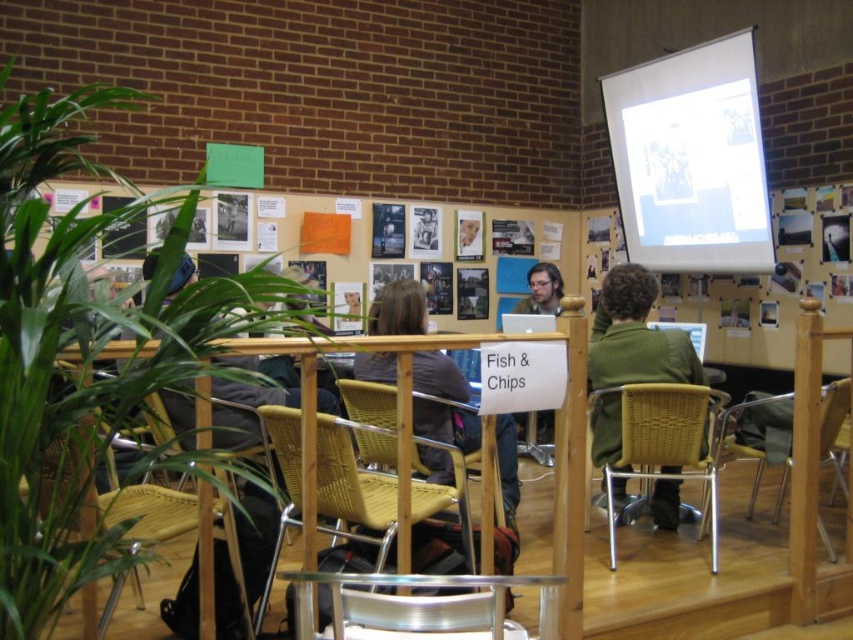
Can you confirm if white matte projection screen at upper right is positioned to the right of clear plastic chair at lower center?

Indeed, white matte projection screen at upper right is positioned on the right side of clear plastic chair at lower center.

Is point (737, 260) positioned behind point (442, 614)?

Yes, point (737, 260) is behind point (442, 614).

The width and height of the screenshot is (853, 640). I want to click on white matte projection screen at upper right, so click(x=691, y=160).

Does green leafy plant at left have a lesser width compared to white matte projection screen at upper right?

Indeed, green leafy plant at left has a lesser width compared to white matte projection screen at upper right.

Who is positioned more to the left, green leafy plant at left or white matte projection screen at upper right?

Result: green leafy plant at left is more to the left.

Locate an element on the screen. green leafy plant at left is located at coordinates (80, 355).

Does green leafy plant at left appear on the right side of white paper at upper center?

Incorrect, green leafy plant at left is not on the right side of white paper at upper center.

Is green leafy plant at left closer to the viewer compared to white paper at upper center?

That is True.

Describe the element at coordinates (80, 355) in the screenshot. This screenshot has height=640, width=853. I see `green leafy plant at left` at that location.

Where is `green leafy plant at left`? The width and height of the screenshot is (853, 640). green leafy plant at left is located at coordinates (80, 355).